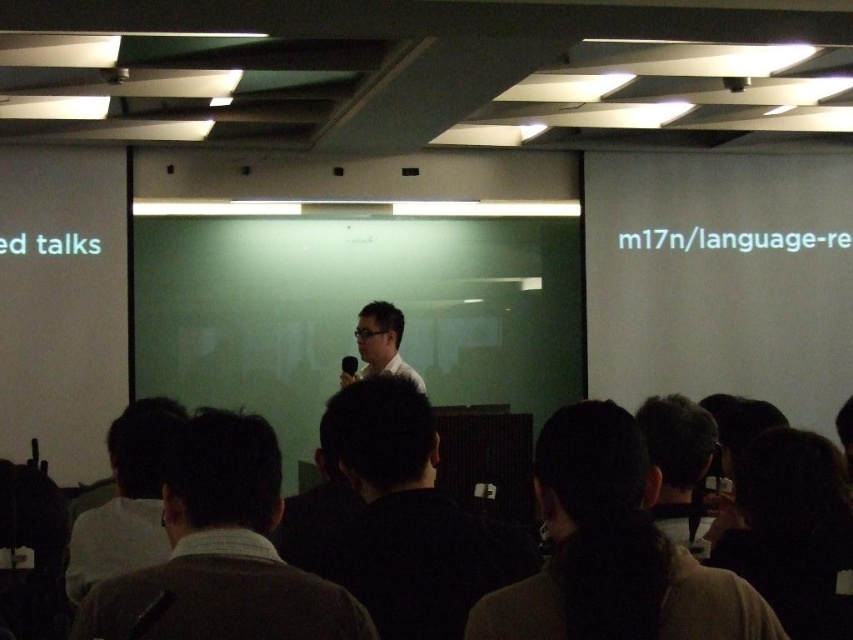
Question: Does black fabric at lower right have a smaller size compared to matte white shirt at center?

Choices:
 (A) no
 (B) yes

Answer: (B)

Question: Does dark hair at center have a larger size compared to white matte shirt at center?

Choices:
 (A) yes
 (B) no

Answer: (B)

Question: Based on their relative distances, which object is farther from the dark hair at lower left?

Choices:
 (A) white matte shirt at center
 (B) black fabric at lower right
 (C) matte white shirt at center

Answer: (C)

Question: Estimate the real-world distances between objects in this image. Which object is farther from the matte white shirt at center?

Choices:
 (A) matte black hair at center
 (B) dark hair at lower left

Answer: (A)

Question: Is dark brown hair at center further to camera compared to matte black hair at center?

Choices:
 (A) no
 (B) yes

Answer: (A)

Question: Which point is closer to the camera taking this photo?

Choices:
 (A) (738, 460)
 (B) (410, 540)
 (C) (190, 497)
 (D) (657, 481)

Answer: (C)